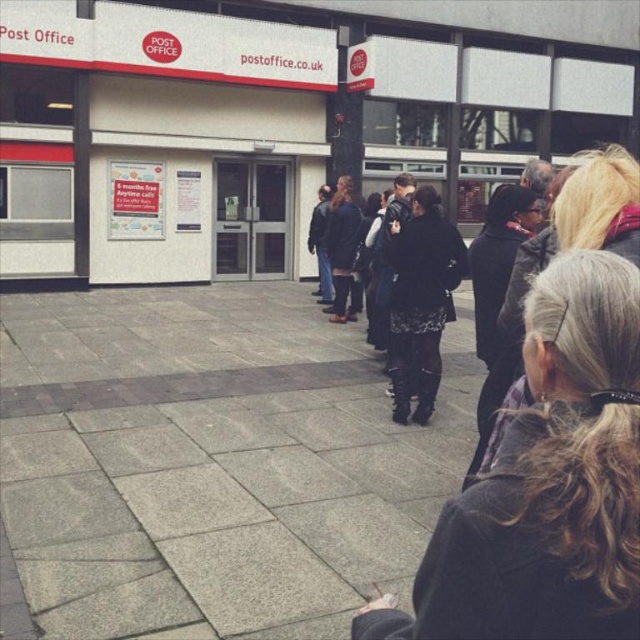
Can you confirm if black leather jacket at right is positioned below black textured coat at center?

Yes, black leather jacket at right is below black textured coat at center.

Which is below, black leather jacket at right or black textured coat at center?

black leather jacket at right is lower down.

Between point (364, 616) and point (454, 273), which one is positioned behind?

The point (454, 273) is more distant.

Where is `black leather jacket at right`? This screenshot has width=640, height=640. black leather jacket at right is located at coordinates (552, 451).